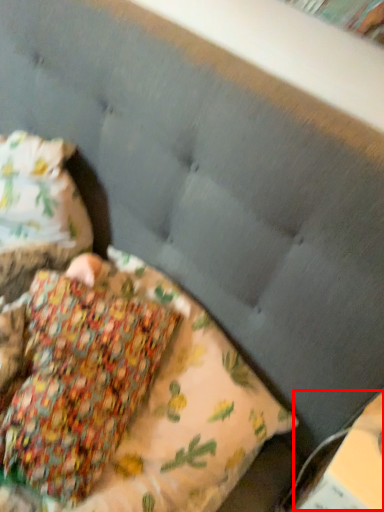
Question: In this image, where is paperback book (annotated by the red box) located relative to pillow?

Choices:
 (A) left
 (B) right

Answer: (B)